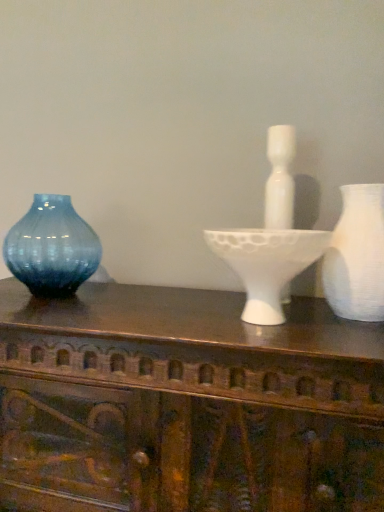
The height and width of the screenshot is (512, 384). I want to click on free space in front of white matte candle holder at center, so click(291, 346).